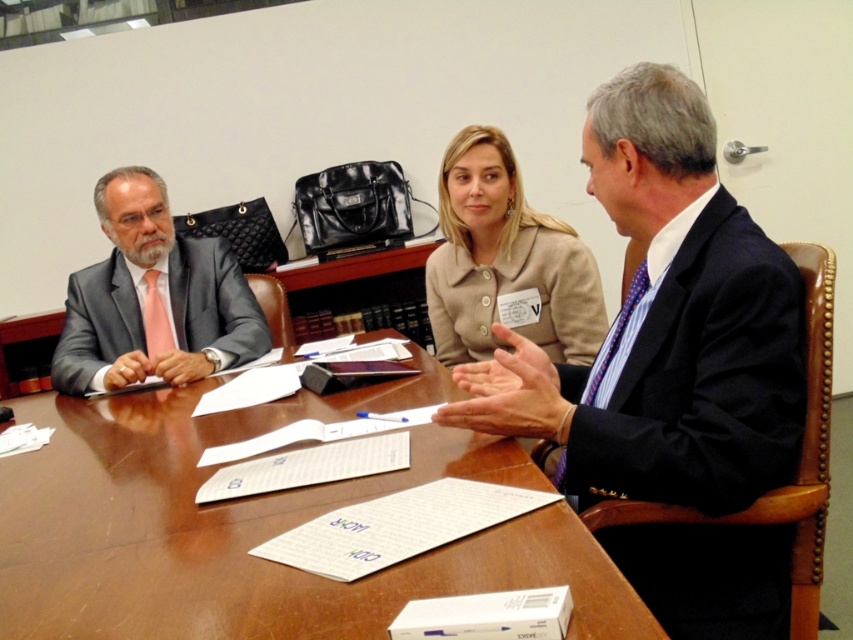
Question: Can you confirm if wooden table at center is thinner than beige fabric jacket at center?

Choices:
 (A) yes
 (B) no

Answer: (B)

Question: Does matte gray suit at left appear on the left side of beige fabric jacket at center?

Choices:
 (A) no
 (B) yes

Answer: (B)

Question: Which object is positioned closest to the wooden table at center?

Choices:
 (A) beige fabric jacket at center
 (B) navy blue suit at right

Answer: (B)

Question: Observing the image, what is the correct spatial positioning of wooden table at center in reference to matte gray suit at left?

Choices:
 (A) left
 (B) right

Answer: (B)

Question: Which of the following is the farthest from the observer?

Choices:
 (A) navy blue suit at right
 (B) wooden table at center

Answer: (A)

Question: Among these points, which one is nearest to the camera?

Choices:
 (A) (144, 392)
 (B) (648, 529)
 (C) (488, 209)
 (D) (113, 237)

Answer: (B)